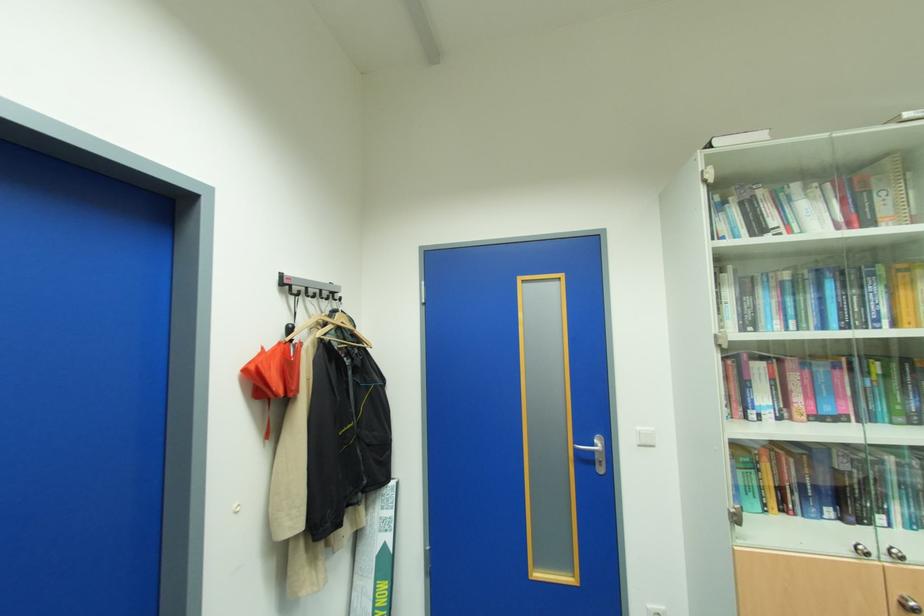
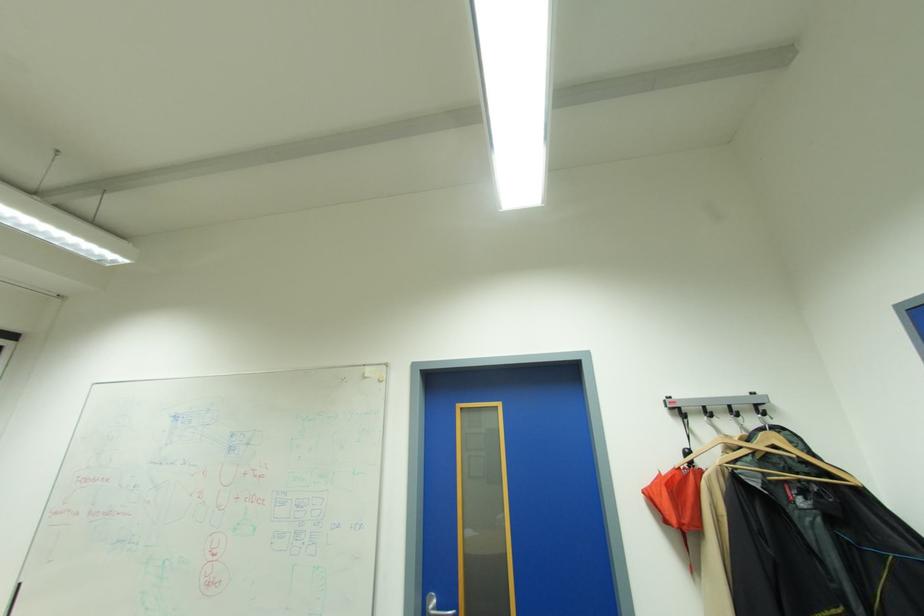
In the second image, find the point that corresponds to (x=271, y=349) in the first image.

(667, 474)